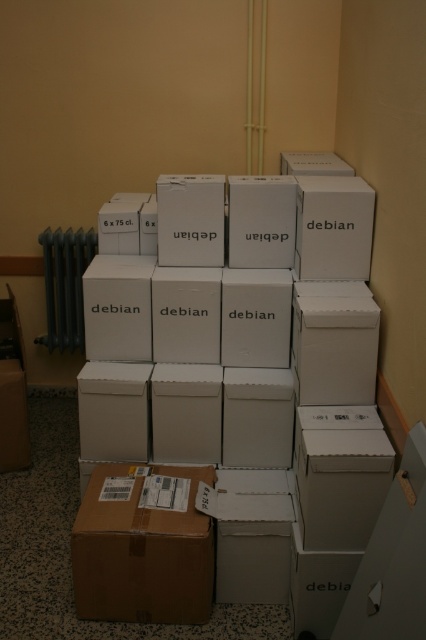
Question: Estimate the real-world distances between objects in this image. Which object is farther from the white cardboard box at center?

Choices:
 (A) black metal radiator at left
 (B) brown cardboard box at lower left

Answer: (A)

Question: Does white cardboard box at center appear on the right side of brown cardboard box at lower left?

Choices:
 (A) no
 (B) yes

Answer: (B)

Question: Where is white cardboard box at center located in relation to black metal radiator at left in the image?

Choices:
 (A) right
 (B) left

Answer: (A)

Question: Which of the following is the farthest from the observer?

Choices:
 (A) (111, 518)
 (B) (39, 237)
 (C) (363, 461)

Answer: (B)

Question: Which of the following is the farthest from the observer?

Choices:
 (A) (242, 280)
 (B) (74, 342)
 (C) (172, 563)

Answer: (B)

Question: Is brown cardboard box at lower left closer to camera compared to black metal radiator at left?

Choices:
 (A) yes
 (B) no

Answer: (A)